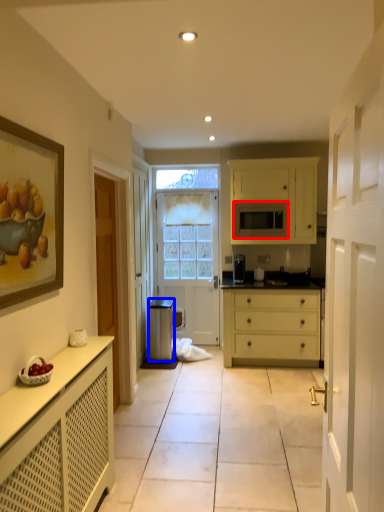
Question: Which object appears closest to the camera in this image, microwave oven (highlighted by a red box) or trash bin/can (highlighted by a blue box)?

Choices:
 (A) microwave oven
 (B) trash bin/can

Answer: (B)